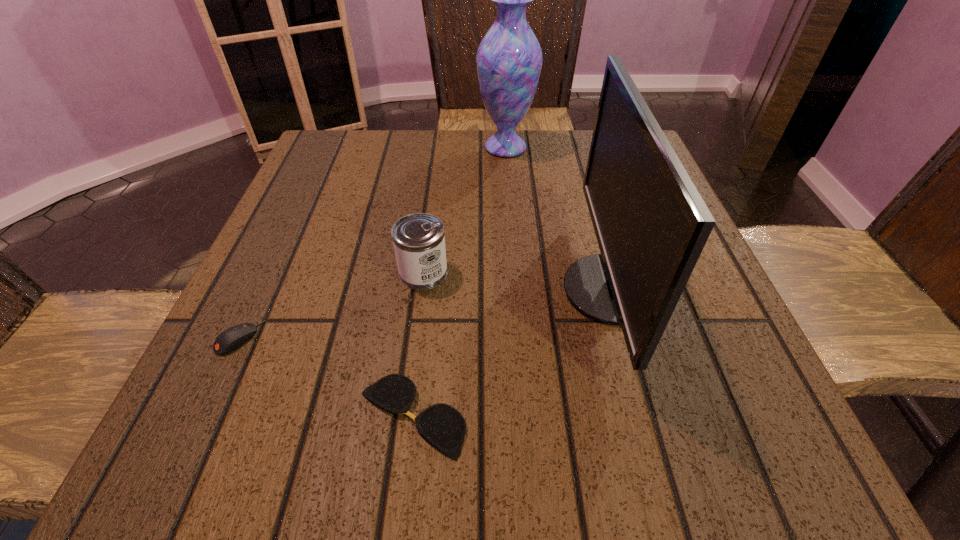
Identify the location of free region located on the screen side of the monitor. click(414, 290).

The image size is (960, 540). In order to click on vacant area located on the back of the third tallest object in this screenshot , I will do `click(439, 150)`.

Where is `vacant space positioned 0.310m on the right of the fourth tallest object`? This screenshot has width=960, height=540. vacant space positioned 0.310m on the right of the fourth tallest object is located at coordinates [x=463, y=338].

At what (x,y) coordinates should I click in order to perform the action: click on blank area located on the right of the spectacles. Please return your answer as a coordinate pair (x, y). The width and height of the screenshot is (960, 540). Looking at the image, I should click on (732, 416).

Where is `object located at the far edge`? object located at the far edge is located at coordinates (509, 58).

I want to click on object that is at the near edge, so click(442, 425).

The image size is (960, 540). Identify the location of object positioned at the left edge. (229, 340).

You are a GUI agent. You are given a task and a screenshot of the screen. Output one action in this format:
    pyautogui.click(x=<x>, y=<y>)
    Task: Click on the object at the right edge
    The image size is (960, 540).
    Given the screenshot: What is the action you would take?
    pyautogui.click(x=651, y=224)

Locate an element on the screen. The image size is (960, 540). vacant space at the far edge of the desktop is located at coordinates coord(521,178).

Where is `vacant space at the left edge of the desktop`? This screenshot has width=960, height=540. vacant space at the left edge of the desktop is located at coordinates (294, 279).